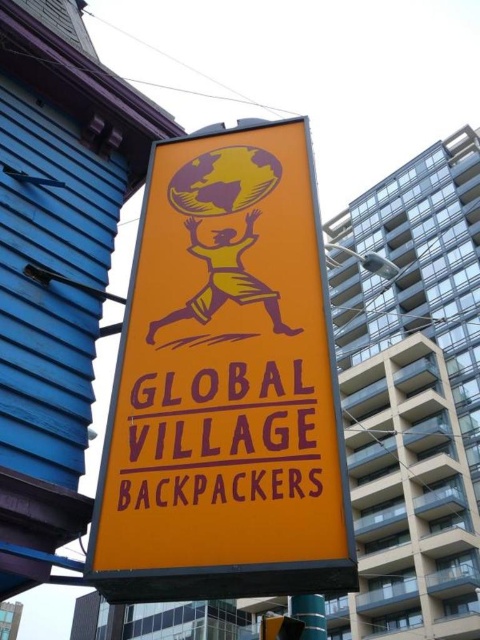
Find the location of `orange matte signboard at center`. orange matte signboard at center is located at coordinates (225, 385).

Between point (173, 292) and point (239, 385), which one is positioned in front?

Point (239, 385)

Identify the location of orange matte signboard at center. (225, 385).

Can you confirm if purple matte sign at center is taller than metallic blue pole at lower center?

No, purple matte sign at center is not taller than metallic blue pole at lower center.

Is point (167, 454) behind point (322, 637)?

No, (167, 454) is closer to viewer.

Find the location of a particular element. purple matte sign at center is located at coordinates (219, 444).

Is orange matte signboard at center smaller than metallic blue pole at lower center?

No, orange matte signboard at center is not smaller than metallic blue pole at lower center.

Between point (164, 348) and point (308, 605), which one is positioned behind?

Positioned behind is point (308, 605).

Which is behind, point (289, 522) or point (312, 593)?

The point (289, 522) is more distant.

Identify the location of orange matte signboard at center. (225, 385).